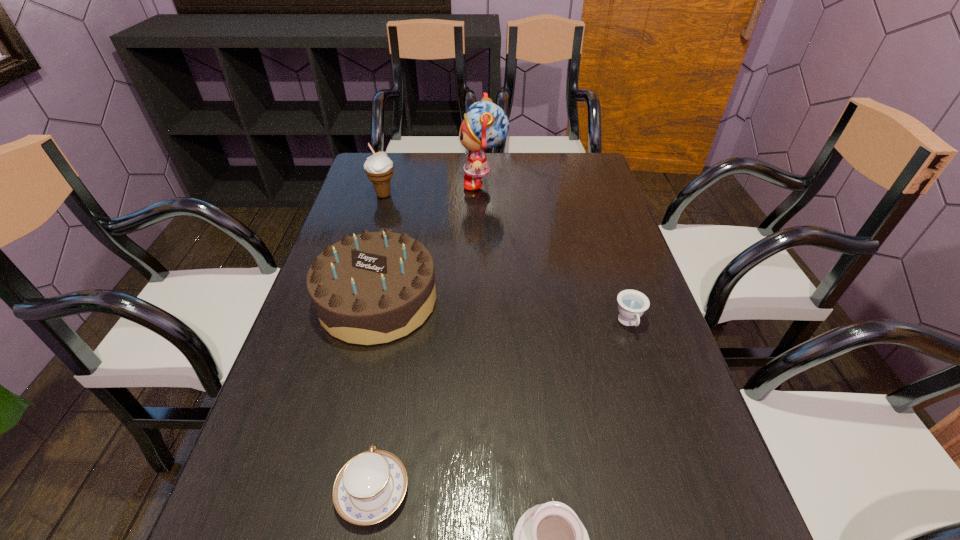
Where is `the tallest object`? The height and width of the screenshot is (540, 960). the tallest object is located at coordinates (485, 125).

Where is `icecream`? This screenshot has height=540, width=960. icecream is located at coordinates (379, 168).

Where is `birthday cake`? The height and width of the screenshot is (540, 960). birthday cake is located at coordinates (372, 288).

Where is `the rightmost object`? The image size is (960, 540). the rightmost object is located at coordinates (631, 303).

This screenshot has width=960, height=540. I want to click on the rightmost teacup, so click(631, 303).

You are a GUI agent. You are given a task and a screenshot of the screen. Output one action in this format:
    pyautogui.click(x=<x>, y=<y>)
    Task: Click on the leftmost teacup
    This screenshot has height=540, width=960.
    Given the screenshot: What is the action you would take?
    pyautogui.click(x=370, y=486)

Where is `vacant space situated on the face of the doll`? vacant space situated on the face of the doll is located at coordinates (390, 183).

Locate an element on the screen. The image size is (960, 540). free space located 0.340m on the face of the doll is located at coordinates (356, 183).

Where is `vacant space located 0.170m on the face of the doll`? This screenshot has width=960, height=540. vacant space located 0.170m on the face of the doll is located at coordinates (408, 183).

Where is `vacant space located 0.110m on the back of the icecream`? This screenshot has height=540, width=960. vacant space located 0.110m on the back of the icecream is located at coordinates (391, 170).